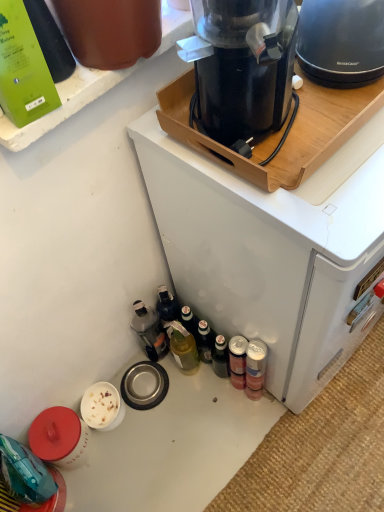
In order to click on free space above black plastic coffee maker at upper center (from a real-world perspective) in this screenshot , I will do [312, 136].